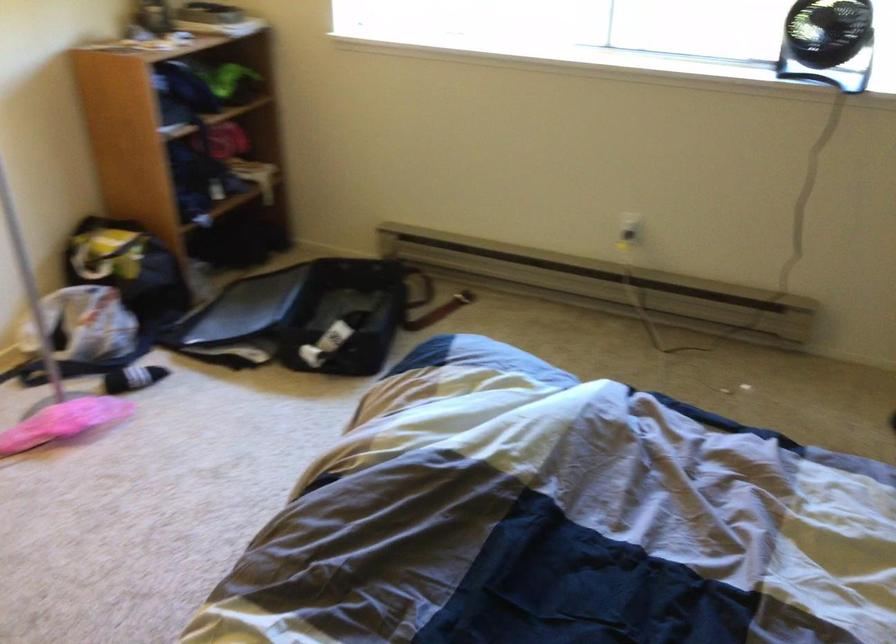
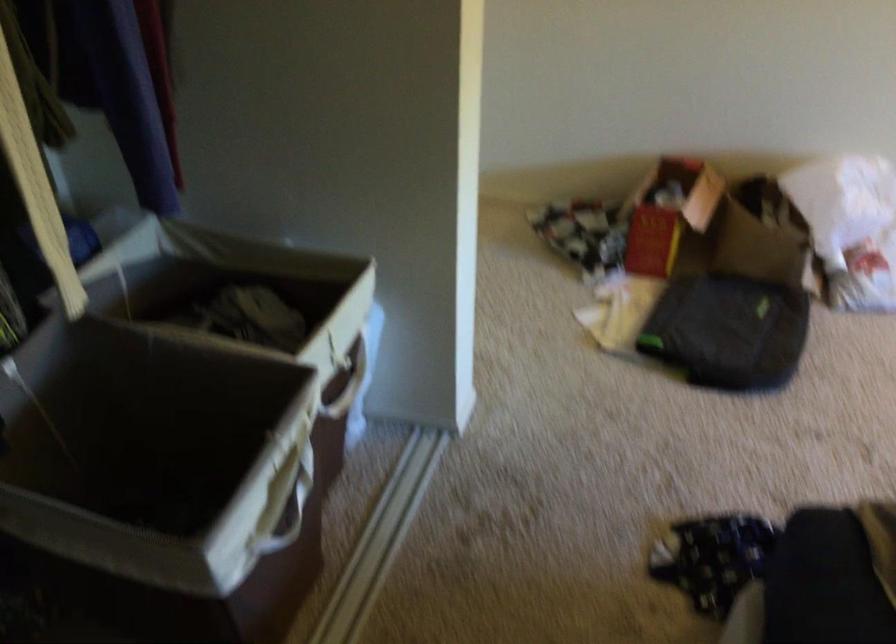
Based on the continuous images, in which direction is the camera rotating?

The rotation direction of the camera is left-down.